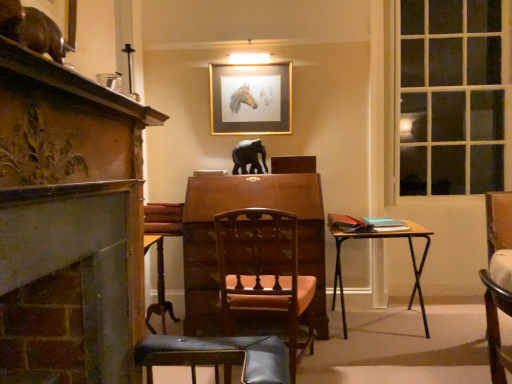
This screenshot has width=512, height=384. In order to click on vacant point to the left of wooden chair at right, marked as the 1th chair in a right-to-left arrangement in this screenshot , I will do `click(457, 352)`.